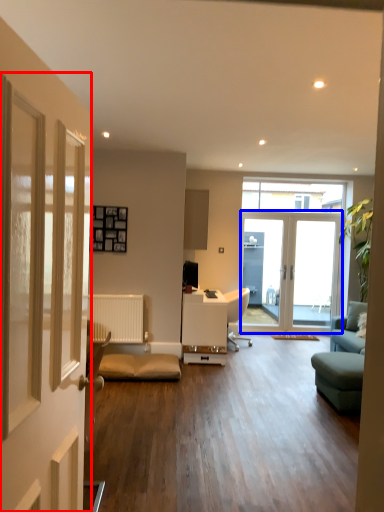
Question: Among these objects, which one is farthest to the camera, door (highlighted by a red box) or door (highlighted by a blue box)?

Choices:
 (A) door
 (B) door

Answer: (B)